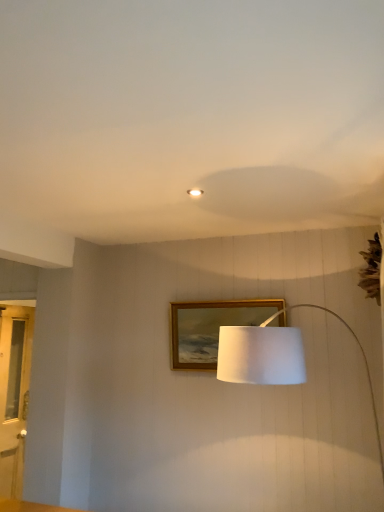
Question: In terms of size, does matte white ceiling light at center appear bigger or smaller than white fabric lampshade at center?

Choices:
 (A) small
 (B) big

Answer: (A)

Question: Based on their positions, is matte white ceiling light at center located to the left or right of white fabric lampshade at center?

Choices:
 (A) right
 (B) left

Answer: (B)

Question: Which is nearer to the clear glass door at left?

Choices:
 (A) white fabric lampshade at center
 (B) matte white ceiling light at center
 (C) gold wooden picture frame at center

Answer: (C)

Question: Estimate the real-world distances between objects in this image. Which object is closer to the matte white ceiling light at center?

Choices:
 (A) gold wooden picture frame at center
 (B) white fabric lampshade at center
 (C) clear glass door at left

Answer: (B)